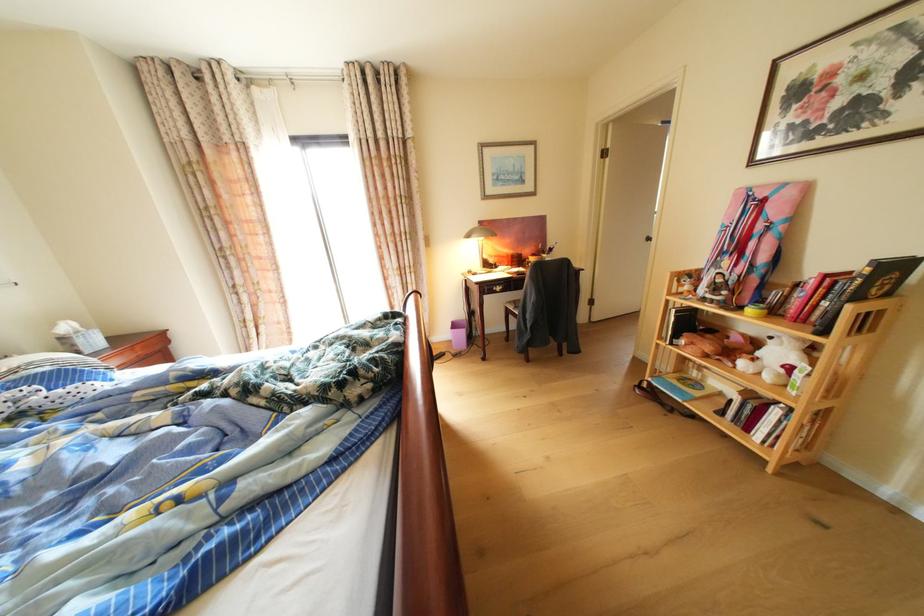
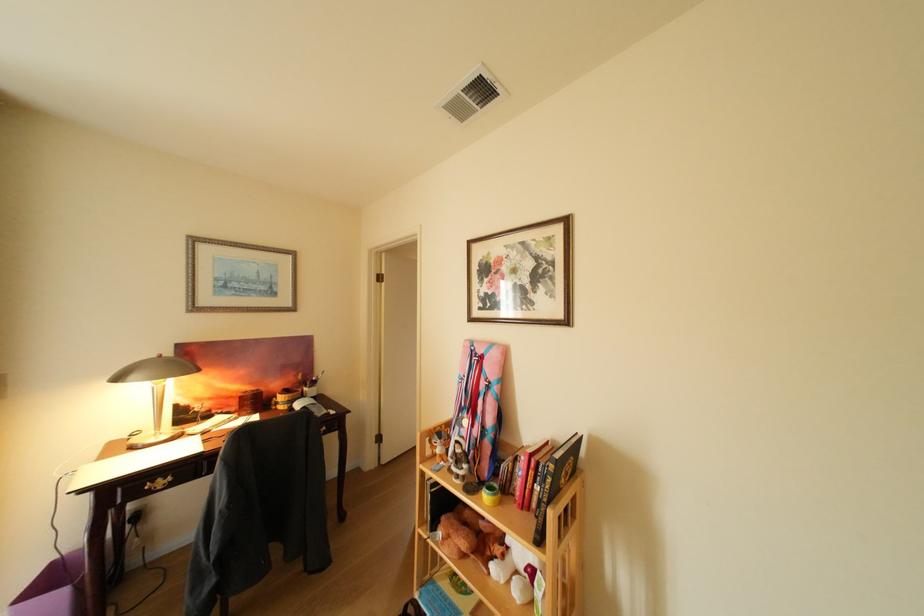
Where in the second image is the point corresponding to pixel 553 246 from the first image?

(313, 376)